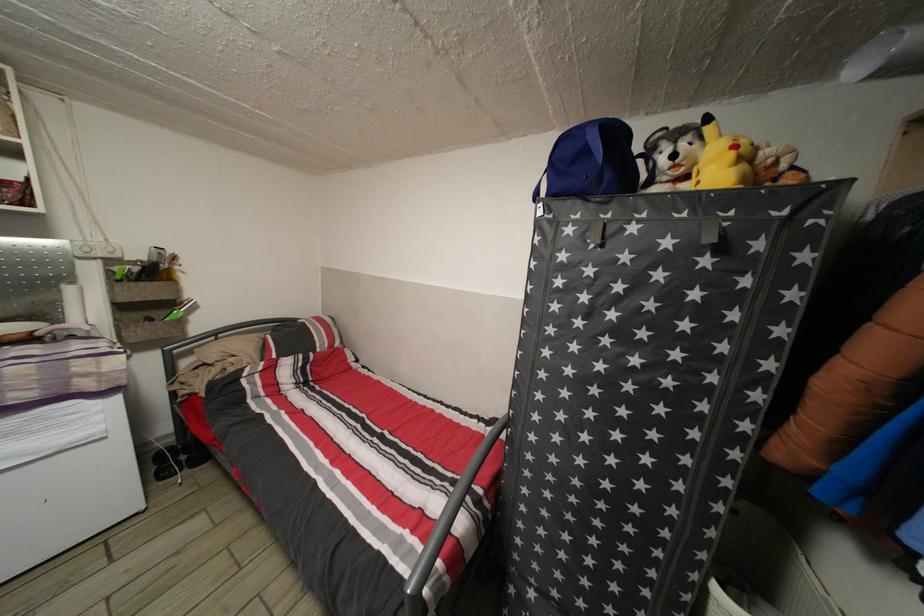
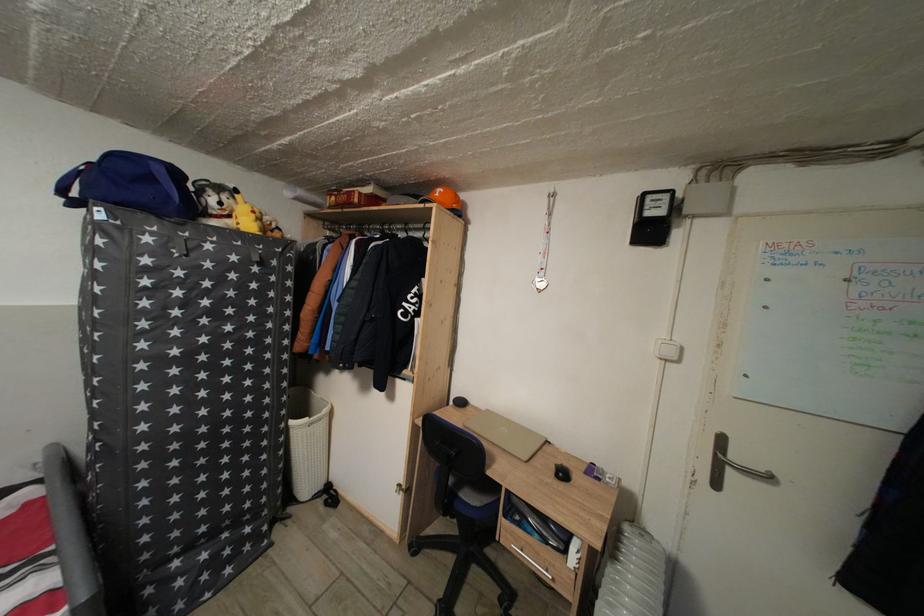
Question: How did the camera likely rotate?

Choices:
 (A) Left
 (B) Right
 (C) Up
 (D) Down

Answer: (B)